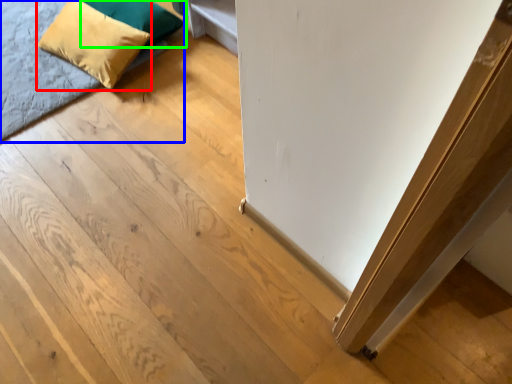
Question: Considering the real-world distances, which object is farthest from pillow (highlighted by a red box)? bed (highlighted by a blue box) or pillow (highlighted by a green box)?

Choices:
 (A) bed
 (B) pillow

Answer: (A)